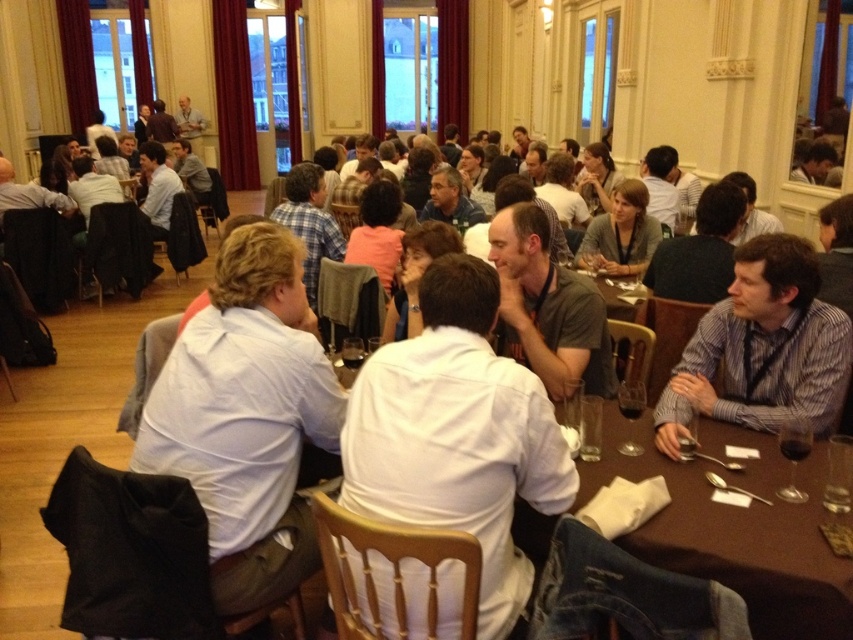
Question: Which point is closer to the camera?

Choices:
 (A) (666, 456)
 (B) (410, 632)

Answer: (B)

Question: Where is striped cotton shirt at right located in relation to brown wooden table at center in the image?

Choices:
 (A) below
 (B) above

Answer: (B)

Question: Which of these objects is positioned farthest from the striped cotton shirt at right?

Choices:
 (A) brown wooden table at center
 (B) brown wooden table at lower right
 (C) white cotton shirt at center

Answer: (C)

Question: Can you confirm if white cotton shirt at center is positioned to the right of brown wooden table at lower right?

Choices:
 (A) yes
 (B) no

Answer: (B)

Question: Is white cotton shirt at center closer to camera compared to brown wooden table at center?

Choices:
 (A) no
 (B) yes

Answer: (A)

Question: Which object is positioned farthest from the striped cotton shirt at right?

Choices:
 (A) brown wooden table at center
 (B) brown wooden table at lower right

Answer: (A)